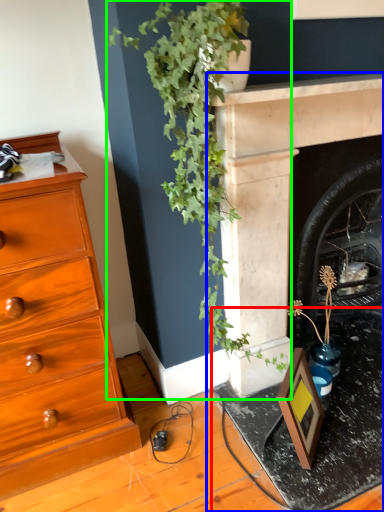
Question: Estimate the real-world distances between objects in this image. Which object is closer to table (highlighted by a red box), fireplace (highlighted by a blue box) or houseplant (highlighted by a green box)?

Choices:
 (A) fireplace
 (B) houseplant

Answer: (A)